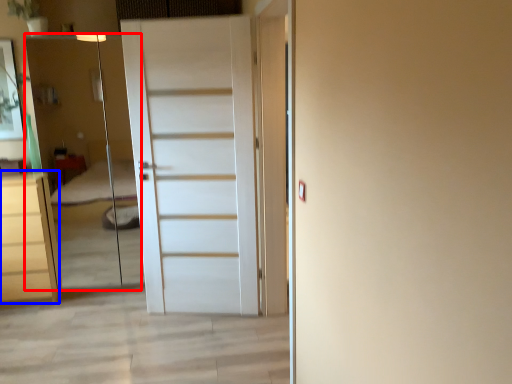
Question: Which object is further to the camera taking this photo, elevator (highlighted by a red box) or chest of drawers (highlighted by a blue box)?

Choices:
 (A) elevator
 (B) chest of drawers

Answer: (B)